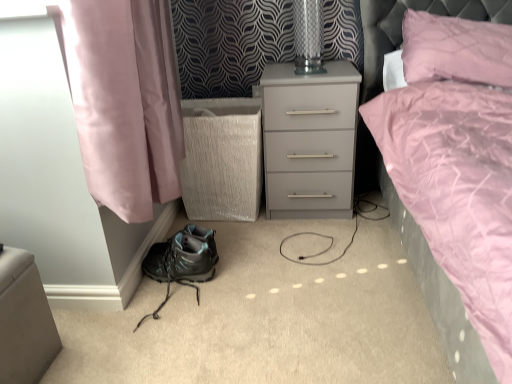
What do you see at coordinates (308, 36) in the screenshot?
I see `transparent glass table lamp at upper center` at bounding box center [308, 36].

Find the location of a particular element. The width and height of the screenshot is (512, 384). transparent glass table lamp at upper center is located at coordinates (308, 36).

Find the location of a particular element. transparent glass table lamp at upper center is located at coordinates (308, 36).

Which is more to the right, transparent glass table lamp at upper center or matte gray nightstand at center?

From the viewer's perspective, matte gray nightstand at center appears more on the right side.

Which object is thinner, transparent glass table lamp at upper center or matte gray nightstand at center?

Thinner between the two is transparent glass table lamp at upper center.

Considering the sizes of objects transparent glass table lamp at upper center and matte gray nightstand at center in the image provided, who is taller, transparent glass table lamp at upper center or matte gray nightstand at center?

Standing taller between the two is matte gray nightstand at center.

Measure the distance between transparent glass table lamp at upper center and matte gray nightstand at center.

12.11 inches.

Is matte black hiking boot at lower left aimed at matte black hiking boot at lower left?

No, matte black hiking boot at lower left is not turned towards matte black hiking boot at lower left.

Does point (179, 268) come closer to viewer compared to point (165, 261)?

That is True.

From the image's perspective, between matte black hiking boot at lower left and matte black hiking boot at lower left, who is located below?

matte black hiking boot at lower left is shown below in the image.

From a real-world perspective, relative to matte black hiking boot at lower left, is matte black hiking boot at lower left vertically above or below?

matte black hiking boot at lower left is below matte black hiking boot at lower left.

How distant is matte black hiking boot at lower left from pink quilted pillow at upper right?

matte black hiking boot at lower left and pink quilted pillow at upper right are 3.60 feet apart from each other.

The height and width of the screenshot is (384, 512). Find the location of `shoe behind the pink quilted pillow at upper right`. shoe behind the pink quilted pillow at upper right is located at coordinates (183, 256).

Does matte black hiking boot at lower left touch pink quilted pillow at upper right?

matte black hiking boot at lower left is not next to pink quilted pillow at upper right, and they're not touching.

Is matte black hiking boot at lower left taller than pink quilted pillow at upper right?

No.

Can you confirm if matte gray nightstand at center is wider than transparent glass table lamp at upper center?

Yes, matte gray nightstand at center is wider than transparent glass table lamp at upper center.

From the picture: Is matte gray nightstand at center positioned before transparent glass table lamp at upper center?

Yes.

Can you tell me how much matte gray nightstand at center and transparent glass table lamp at upper center differ in facing direction?

1.04 degrees separate the facing orientations of matte gray nightstand at center and transparent glass table lamp at upper center.

How distant is matte gray nightstand at center from transparent glass table lamp at upper center?

12.11 inches.

Locate an element on the screen. table lamp above the matte black hiking boot at lower left (from a real-world perspective) is located at coordinates (308, 36).

Is matte black hiking boot at lower left not within transparent glass table lamp at upper center?

Absolutely, matte black hiking boot at lower left is external to transparent glass table lamp at upper center.

From a real-world perspective, is matte black hiking boot at lower left physically below transparent glass table lamp at upper center?

Yes, from a real-world perspective, matte black hiking boot at lower left is under transparent glass table lamp at upper center.

At what (x,y) coordinates should I click in order to perform the action: click on pillow on the right of transparent glass table lamp at upper center. Please return your answer as a coordinate pair (x, y). This screenshot has width=512, height=384. Looking at the image, I should click on (456, 50).

Which is behind, point (501, 34) or point (316, 38)?

The point (316, 38) is more distant.

Who is shorter, pink quilted pillow at upper right or transparent glass table lamp at upper center?

With less height is transparent glass table lamp at upper center.

Considering the points (193, 232) and (298, 65), which point is behind, point (193, 232) or point (298, 65)?

The point (298, 65) is more distant.

How distant is matte black hiking boot at lower left from transparent glass table lamp at upper center?

matte black hiking boot at lower left and transparent glass table lamp at upper center are 34.47 inches apart.

Which object is wider, matte black hiking boot at lower left or transparent glass table lamp at upper center?

matte black hiking boot at lower left is wider.

Identify the location of shoe below the transparent glass table lamp at upper center (from a real-world perspective). This screenshot has width=512, height=384. (183, 256).

Find the location of a particular element. Image resolution: width=512 pixels, height=384 pixels. table lamp above the matte gray nightstand at center (from the image's perspective) is located at coordinates (308, 36).

Find the location of a particular element. The height and width of the screenshot is (384, 512). footwear in front of the matte black hiking boot at lower left is located at coordinates (181, 261).

From the image, which object appears to be nearer to matte black hiking boot at lower left, pink quilted pillow at upper right or transparent glass table lamp at upper center?

transparent glass table lamp at upper center lies closer to matte black hiking boot at lower left than the other object.

From the image, which object appears to be nearer to matte black hiking boot at lower left, pink quilted pillow at upper right or matte black hiking boot at lower left?

The object closer to matte black hiking boot at lower left is matte black hiking boot at lower left.

When comparing their distances from matte black hiking boot at lower left, does matte black hiking boot at lower left or transparent glass table lamp at upper center seem closer?

Among the two, matte black hiking boot at lower left is located nearer to matte black hiking boot at lower left.

Estimate the real-world distances between objects in this image. Which object is closer to transparent glass table lamp at upper center, pink quilted pillow at upper right or matte black hiking boot at lower left?

Based on the image, pink quilted pillow at upper right appears to be nearer to transparent glass table lamp at upper center.

Which object lies further to the anchor point transparent glass table lamp at upper center, matte gray nightstand at center or matte black hiking boot at lower left?

matte black hiking boot at lower left is further to transparent glass table lamp at upper center.

From the image, which object appears to be farther from matte black hiking boot at lower left, matte gray nightstand at center or pink quilted pillow at upper right?

pink quilted pillow at upper right lies further to matte black hiking boot at lower left than the other object.

From the image, which object appears to be nearer to pink quilted pillow at upper right, matte black hiking boot at lower left or matte black hiking boot at lower left?

Among the two, matte black hiking boot at lower left is located nearer to pink quilted pillow at upper right.

From the image, which object appears to be farther from matte black hiking boot at lower left, pink quilted pillow at upper right or transparent glass table lamp at upper center?

The object further to matte black hiking boot at lower left is pink quilted pillow at upper right.

At what (x,y) coordinates should I click in order to perform the action: click on shoe between transparent glass table lamp at upper center and matte black hiking boot at lower left from top to bottom. Please return your answer as a coordinate pair (x, y). This screenshot has height=384, width=512. Looking at the image, I should click on (183, 256).

I want to click on shoe between matte black hiking boot at lower left and pink quilted pillow at upper right, so (x=183, y=256).

Identify the location of table lamp between matte black hiking boot at lower left and pink quilted pillow at upper right. The image size is (512, 384). (308, 36).

Locate an element on the screen. This screenshot has width=512, height=384. nightstand situated between transparent glass table lamp at upper center and pink quilted pillow at upper right from left to right is located at coordinates (310, 139).